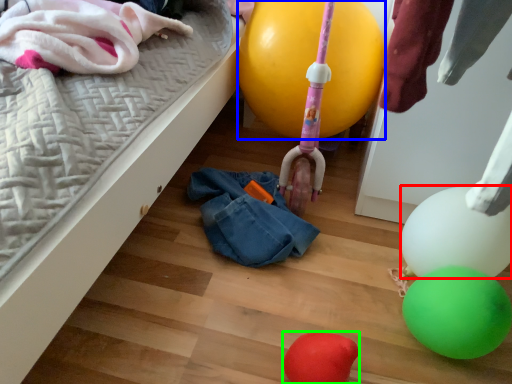
Question: Which object is the closest to the balloon (highlighted by a red box)? Choose among these: balloon (highlighted by a blue box) or balloon (highlighted by a green box).

Choices:
 (A) balloon
 (B) balloon

Answer: (B)